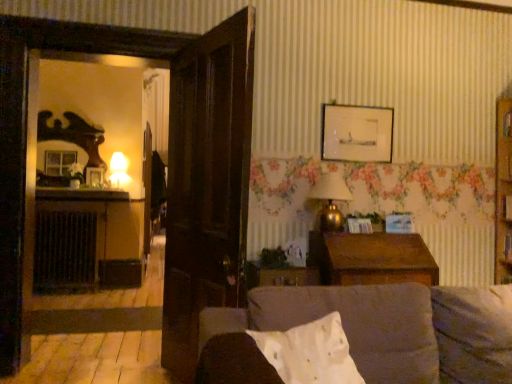
Question: From the image's perspective, is wooden picture frame at upper center, the first picture frame positioned from the top, located above or below velvet brown couch at center?

Choices:
 (A) above
 (B) below

Answer: (A)

Question: From a real-world perspective, is wooden picture frame at upper center, placed as the second picture frame when sorted from bottom to top, above or below velvet brown couch at center?

Choices:
 (A) below
 (B) above

Answer: (B)

Question: Based on their relative distances, which object is nearer to the matte glass picture frame at left, which appears as the first picture frame when viewed from the back?

Choices:
 (A) velvet brown couch at center
 (B) wooden picture frame at upper center, the first picture frame positioned from the front
 (C) white cotton pillow at center
 (D) gold metallic lamp at upper right, marked as the 1th lamp in a right-to-left arrangement
 (E) black metal radiator at left

Answer: (E)

Question: Estimate the real-world distances between objects in this image. Which object is closer to the velvet brown couch at center?

Choices:
 (A) matte glass lamp at left, the 2th lamp from the front
 (B) wooden picture frame at upper center, the first picture frame positioned from the top
 (C) black metal radiator at left
 (D) brown wooden table at center
 (E) matte glass picture frame at left, which is the second picture frame from right to left

Answer: (D)